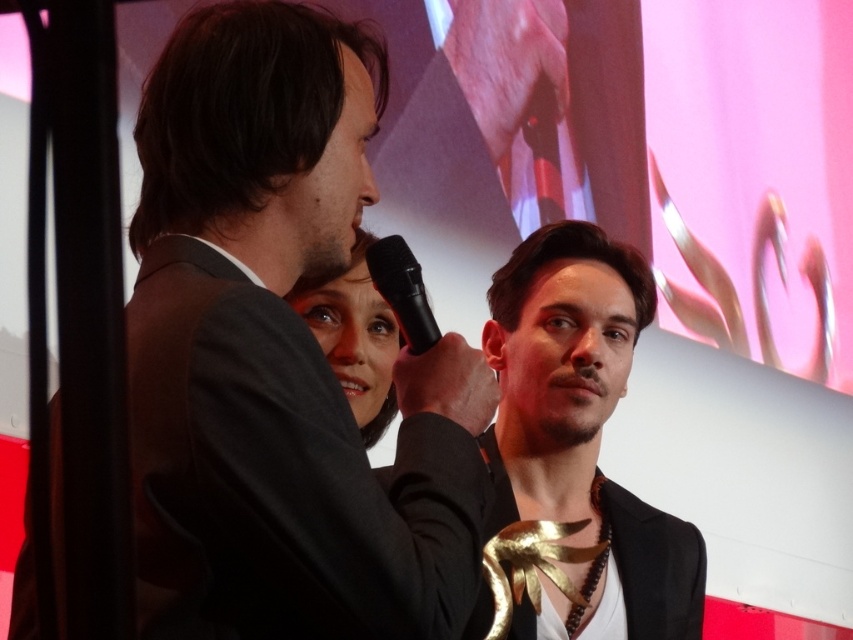
Is point (555, 362) positioned after point (505, 477)?

That is False.

From the picture: Which of these two, shiny black jacket at center or gold metallic jacket at center, stands shorter?

With less height is gold metallic jacket at center.

Between point (654, 637) and point (662, 518), which one is positioned in front?

Point (654, 637) is more forward.

Where is `shiny black jacket at center`? shiny black jacket at center is located at coordinates (581, 436).

Which of these two, shiny black jacket at center or black plastic microphone at center, stands taller?

Standing taller between the two is shiny black jacket at center.

Who is shorter, shiny black jacket at center or black plastic microphone at center?

With less height is black plastic microphone at center.

Between point (543, 273) and point (387, 273), which one is positioned behind?

The point (543, 273) is more distant.

Find the location of a particular element. The height and width of the screenshot is (640, 853). shiny black jacket at center is located at coordinates (581, 436).

Is matte black microphone at center positioned before black plastic microphone at center?

No, it is behind black plastic microphone at center.

Does matte black microphone at center have a lesser width compared to black plastic microphone at center?

No, matte black microphone at center is not thinner than black plastic microphone at center.

Where is `matte black microphone at center`? The width and height of the screenshot is (853, 640). matte black microphone at center is located at coordinates (354, 337).

This screenshot has height=640, width=853. I want to click on matte black microphone at center, so click(354, 337).